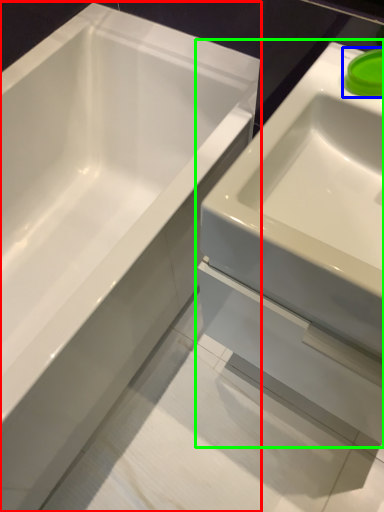
Question: Which is farther away from bathtub (highlighted by a red box)? liquid (highlighted by a blue box) or sink (highlighted by a green box)?

Choices:
 (A) liquid
 (B) sink

Answer: (A)